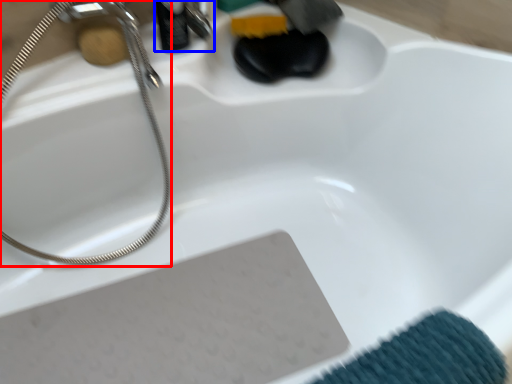
Question: Which object is closer to the camera taking this photo, shower (highlighted by a red box) or faucet (highlighted by a blue box)?

Choices:
 (A) shower
 (B) faucet

Answer: (A)